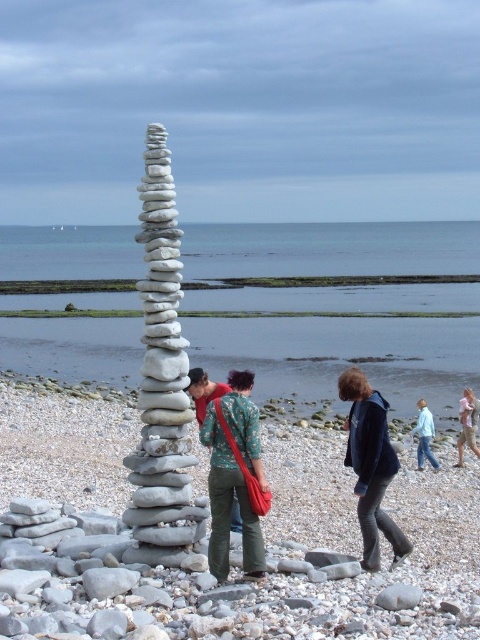
Who is shorter, green camouflage shirt at center or smooth sand at center?

green camouflage shirt at center is shorter.

Does point (248, 403) come farther from viewer compared to point (134, 289)?

No.

Who is more distant from viewer, (243, 412) or (412, 275)?

The point (412, 275) is behind.

Locate an element on the screen. Image resolution: width=480 pixels, height=640 pixels. green camouflage shirt at center is located at coordinates (228, 504).

Between point (286, 451) and point (192, 381), which one is positioned in front?

Point (192, 381)

Does gray stone stack at center appear over floral fabric shirt at center?

No, gray stone stack at center is not above floral fabric shirt at center.

Is point (173, 566) positioned before point (201, 381)?

Yes, point (173, 566) is in front of point (201, 381).

Identify the location of gray stone stack at center. The image size is (480, 640). (206, 540).

Who is lower down, floral fabric shirt at center or green textured jacket at center?

green textured jacket at center is below.

From the picture: Can you confirm if floral fabric shirt at center is positioned to the right of green textured jacket at center?

Incorrect, floral fabric shirt at center is not on the right side of green textured jacket at center.

Is point (204, 380) closer to viewer compared to point (463, 392)?

That is True.

Identify the location of floral fabric shirt at center. The width and height of the screenshot is (480, 640). (204, 392).